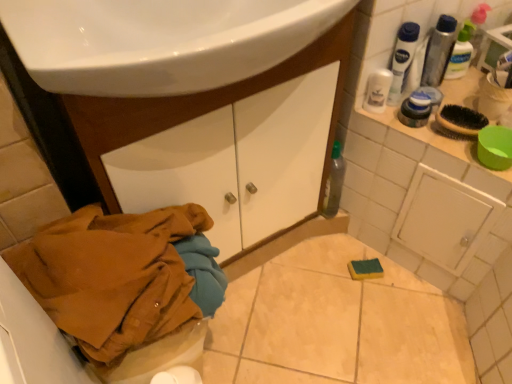
Locate an element on the screen. free space in front of matte black shaving cream at upper right is located at coordinates (438, 149).